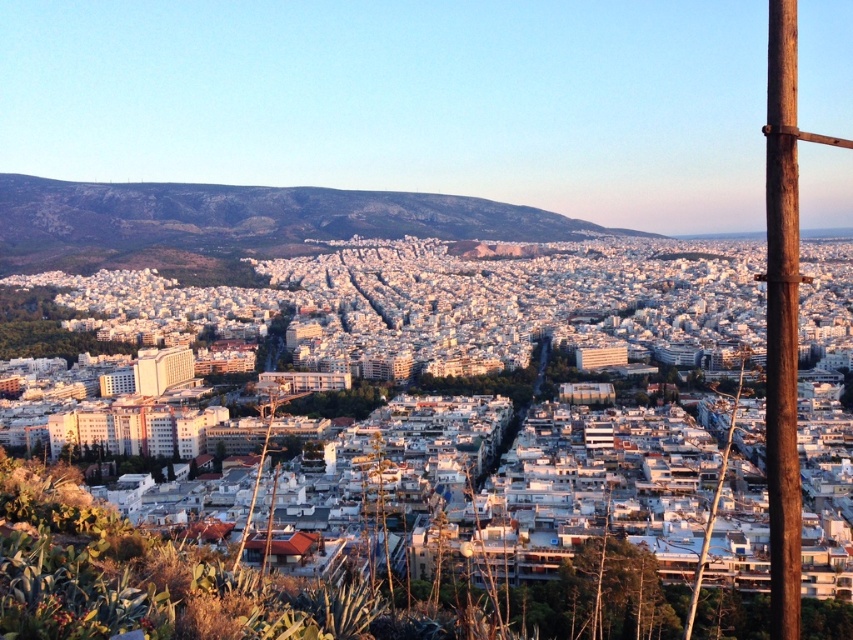
Question: Is brown wooden pole at right below brown wooden telegraph pole at right?

Choices:
 (A) yes
 (B) no

Answer: (B)

Question: Which object is closer to the camera taking this photo?

Choices:
 (A) brown wooden telegraph pole at right
 (B) brown wooden pole at right

Answer: (B)

Question: Which of the following is the farthest from the observer?

Choices:
 (A) brown wooden pole at right
 (B) brown wooden telegraph pole at right

Answer: (B)

Question: Can you confirm if brown wooden pole at right is positioned above brown wooden telegraph pole at right?

Choices:
 (A) no
 (B) yes

Answer: (B)

Question: Which object appears closest to the camera in this image?

Choices:
 (A) brown wooden telegraph pole at right
 (B) brown wooden pole at right

Answer: (B)

Question: Is brown wooden pole at right above brown wooden telegraph pole at right?

Choices:
 (A) yes
 (B) no

Answer: (A)